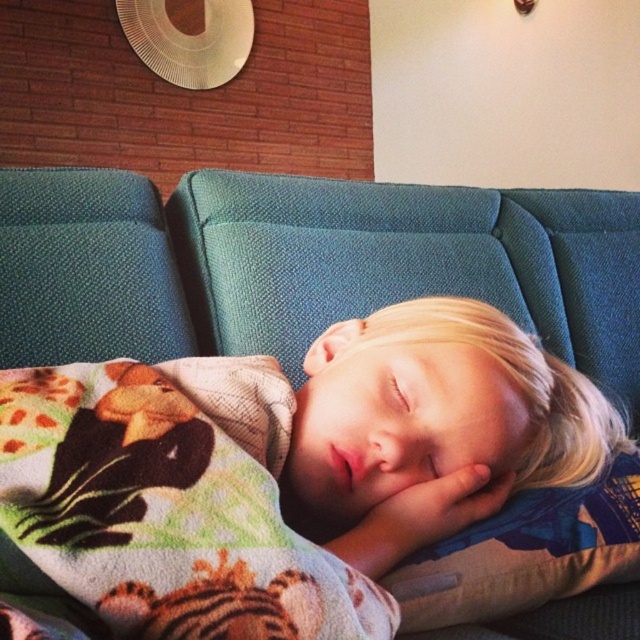
Is teal fabric couch at center smaller than soft fabric pillow at center?

No.

Find the location of a particular element. This screenshot has height=640, width=640. teal fabric couch at center is located at coordinates (412, 257).

Image resolution: width=640 pixels, height=640 pixels. Find the location of `teal fabric couch at center`. teal fabric couch at center is located at coordinates (412, 257).

Does multicolored fleece blanket at center have a lesser width compared to soft fabric pillow at center?

Indeed, multicolored fleece blanket at center has a lesser width compared to soft fabric pillow at center.

Can you confirm if multicolored fleece blanket at center is wider than soft fabric pillow at center?

No, multicolored fleece blanket at center is not wider than soft fabric pillow at center.

Who is more distant from viewer, [16,474] or [636,488]?

The point [636,488] is more distant.

The height and width of the screenshot is (640, 640). Identify the location of multicolored fleece blanket at center. (163, 508).

Measure the distance between teal fabric couch at center and multicolored fleece blanket at center.

teal fabric couch at center and multicolored fleece blanket at center are 19.44 inches apart from each other.

Is teal fabric couch at center below multicolored fleece blanket at center?

No, teal fabric couch at center is not below multicolored fleece blanket at center.

Between point (211, 326) and point (182, 502), which one is positioned behind?

The point (211, 326) is behind.

I want to click on teal fabric couch at center, so (x=412, y=257).